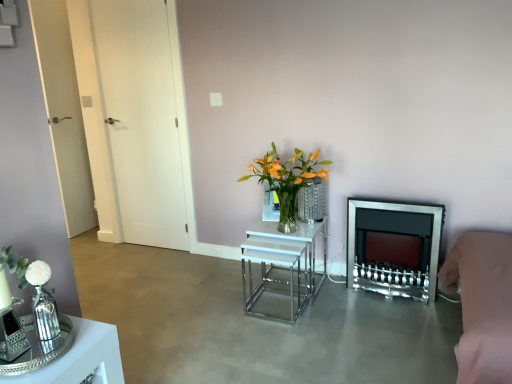
Question: From their relative heights in the image, would you say translucent glass vase at center is taller or shorter than white glossy nesting tables at center, the first table viewed from the back?

Choices:
 (A) short
 (B) tall

Answer: (B)

Question: Looking at their shapes, would you say translucent glass vase at center is wider or thinner than white glossy nesting tables at center, placed as the 1th table when sorted from right to left?

Choices:
 (A) thin
 (B) wide

Answer: (A)

Question: Estimate the real-world distances between objects in this image. Which object is farther from the shiny silver tray at lower left, the first table positioned from the front?

Choices:
 (A) translucent glass vase at center
 (B) white glossy door at left
 (C) shiny silver fireplace at center right
 (D) white glossy nesting tables at center, the 2th table positioned from the front
 (E) clear glass vase at center

Answer: (B)

Question: Considering the real-world distances, which object is farthest from the white glossy nesting tables at center, the 2th table positioned from the front?

Choices:
 (A) shiny silver fireplace at center right
 (B) clear glass vase at center
 (C) white glossy door at left
 (D) white matte square at upper center
 (E) pink fabric couch at lower right

Answer: (C)